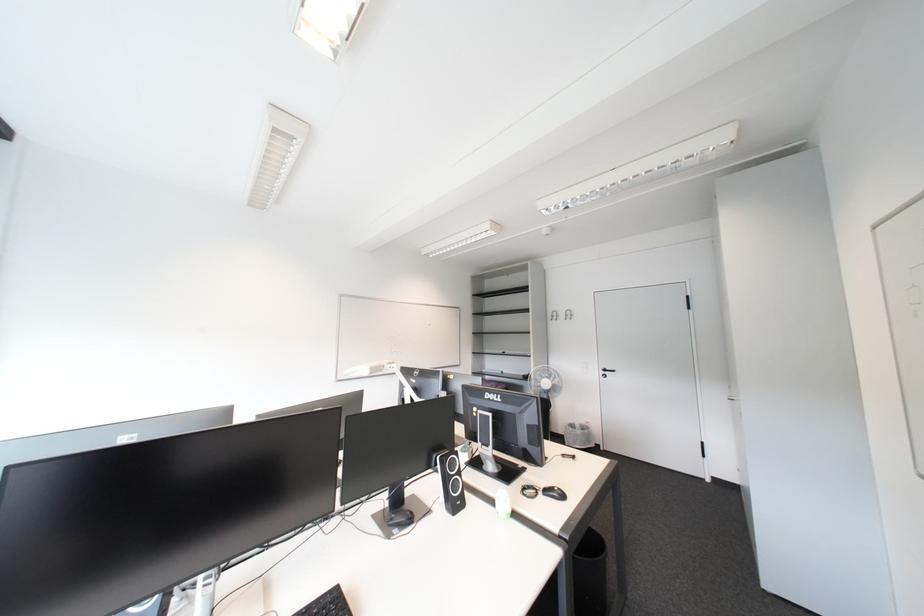
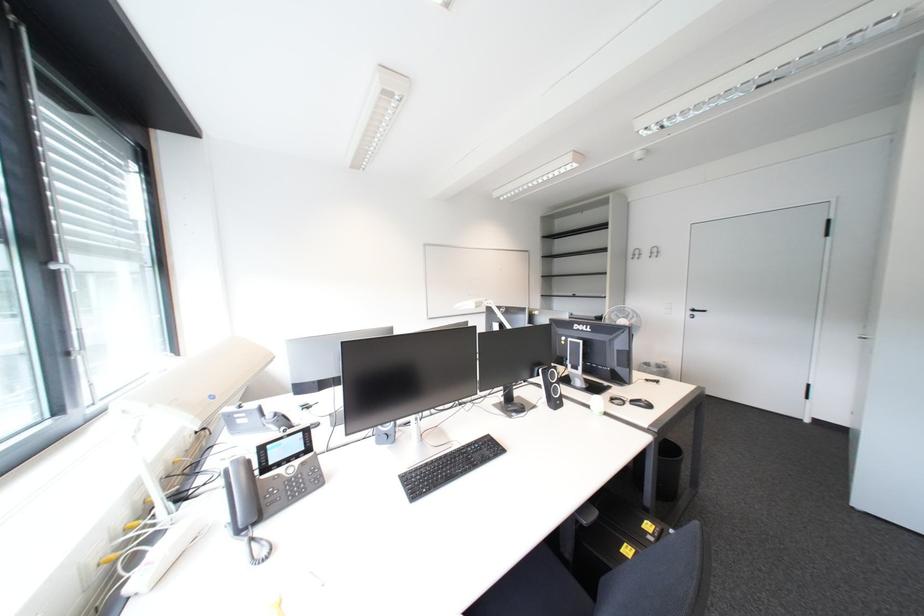
Question: The camera is either moving clockwise (left) or counter-clockwise (right) around the object. The first image is from the beginning of the video and the second image is from the end. Is the camera moving left or right when shooting the video?

Choices:
 (A) Left
 (B) Right

Answer: (B)